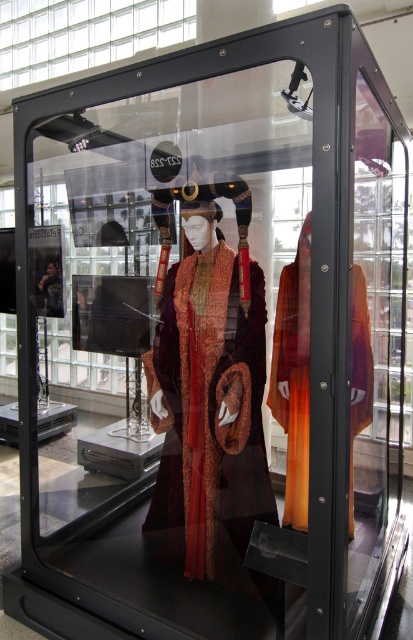
Question: Which object is farther from the camera taking this photo?

Choices:
 (A) velvet orange dress at center
 (B) velvet-like burgundy dress at center

Answer: (B)

Question: Is velvet-like burgundy dress at center thinner than velvet orange dress at center?

Choices:
 (A) no
 (B) yes

Answer: (A)

Question: Is the position of velvet-like burgundy dress at center less distant than that of velvet orange dress at center?

Choices:
 (A) yes
 (B) no

Answer: (B)

Question: Does velvet-like burgundy dress at center have a lesser width compared to velvet orange dress at center?

Choices:
 (A) yes
 (B) no

Answer: (B)